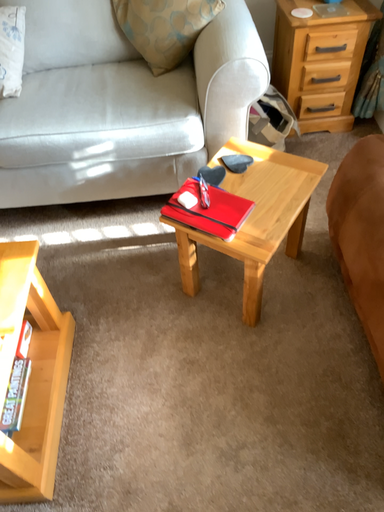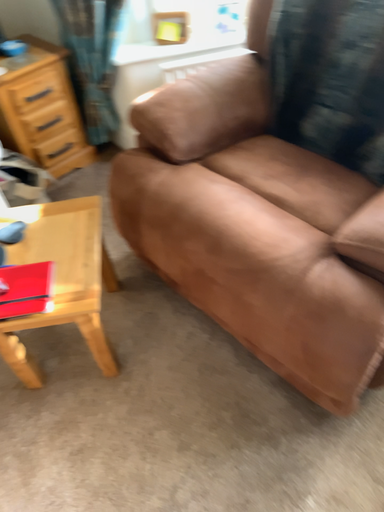
Question: Which way did the camera rotate in the video?

Choices:
 (A) rotated left
 (B) rotated right

Answer: (B)